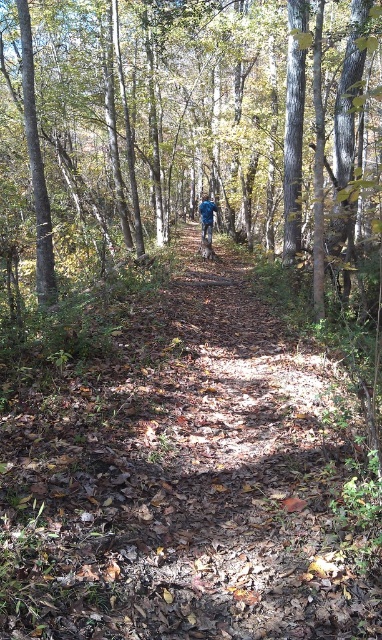
Which of these two, brown wood tree at center or blue fabric jacket at center, stands shorter?

blue fabric jacket at center

Is point (191, 177) behind point (210, 214)?

Yes, point (191, 177) is behind point (210, 214).

Is point (126, 33) behind point (202, 227)?

That is True.

Identify the location of brown wood tree at center. This screenshot has height=640, width=382. (166, 109).